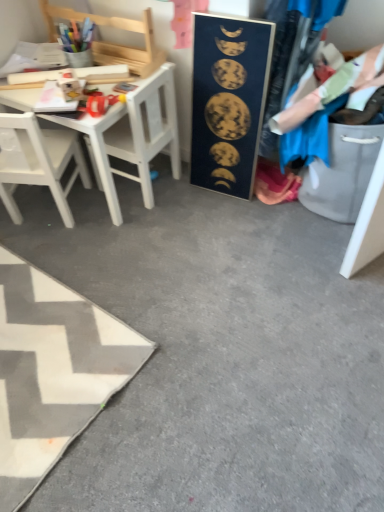
Question: Would you say wooden chair at upper left, the 1th chair in the top-to-bottom sequence, is part of white matte chair at left's contents?

Choices:
 (A) yes
 (B) no

Answer: (B)

Question: Is white matte chair at left thinner than wooden chair at upper left, the 1th chair in the top-to-bottom sequence?

Choices:
 (A) no
 (B) yes

Answer: (A)

Question: Is white matte chair at left aimed at wooden chair at upper left, the 2th chair when ordered from bottom to top?

Choices:
 (A) no
 (B) yes

Answer: (A)

Question: Considering the relative sizes of white matte chair at left and wooden chair at upper left, the 1th chair in the top-to-bottom sequence, in the image provided, is white matte chair at left taller than wooden chair at upper left, the 1th chair in the top-to-bottom sequence,?

Choices:
 (A) yes
 (B) no

Answer: (A)

Question: Considering the relative positions of white matte chair at left and wooden chair at upper left, the 2th chair when ordered from bottom to top, in the image provided, is white matte chair at left to the right of wooden chair at upper left, the 2th chair when ordered from bottom to top, from the viewer's perspective?

Choices:
 (A) yes
 (B) no

Answer: (A)

Question: Looking at their shapes, would you say white fabric rug at lower left is wider or thinner than dark blue matte poster at center?

Choices:
 (A) wide
 (B) thin

Answer: (A)

Question: Considering the relative positions of white fabric rug at lower left and dark blue matte poster at center in the image provided, is white fabric rug at lower left to the left or to the right of dark blue matte poster at center?

Choices:
 (A) left
 (B) right

Answer: (A)

Question: Is white fabric rug at lower left spatially inside dark blue matte poster at center, or outside of it?

Choices:
 (A) inside
 (B) outside

Answer: (B)

Question: Looking at the image, does white fabric rug at lower left seem bigger or smaller compared to dark blue matte poster at center?

Choices:
 (A) small
 (B) big

Answer: (B)

Question: Is wooden chair at upper left, the 1th chair in the top-to-bottom sequence, taller or shorter than white matte chair at left?

Choices:
 (A) short
 (B) tall

Answer: (A)

Question: Visually, is wooden chair at upper left, the 2th chair when ordered from bottom to top, positioned to the left or to the right of white matte chair at left?

Choices:
 (A) left
 (B) right

Answer: (A)

Question: Considering the positions of point (130, 20) and point (142, 138), is point (130, 20) closer or farther from the camera than point (142, 138)?

Choices:
 (A) farther
 (B) closer

Answer: (B)

Question: Is wooden chair at upper left, the 2th chair when ordered from bottom to top, bigger or smaller than white matte chair at left?

Choices:
 (A) big
 (B) small

Answer: (B)

Question: Is point (137, 97) closer or farther from the camera than point (137, 161)?

Choices:
 (A) closer
 (B) farther

Answer: (A)

Question: Looking at the image, does white matte chair at left seem bigger or smaller compared to white wooden desk at upper left?

Choices:
 (A) big
 (B) small

Answer: (B)